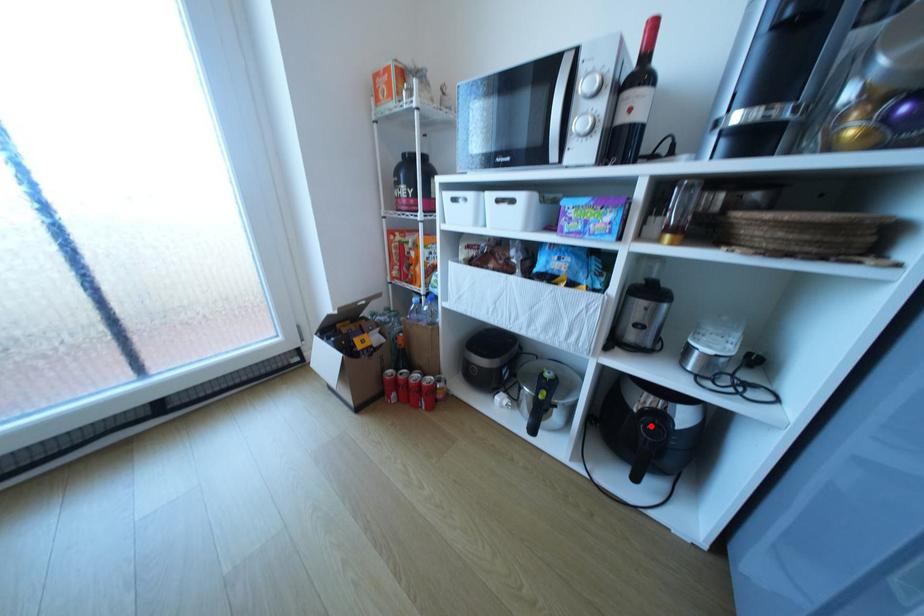
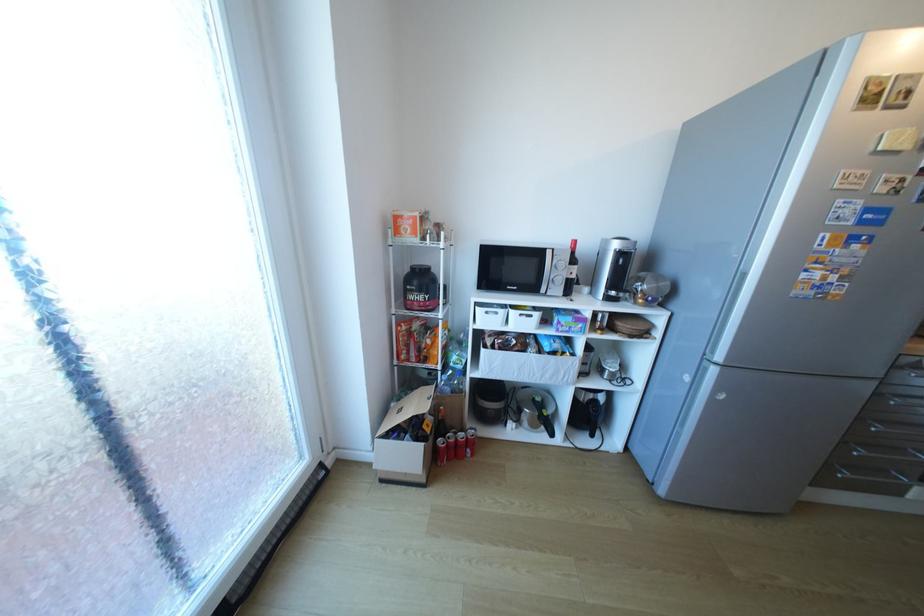
Question: I am providing you with two images of the same scene from different viewpoints. A red point is shown in image1. For the corresponding object point in image2, is it positioned nearer or farther from the camera?

Choices:
 (A) Nearer
 (B) Farther

Answer: (B)